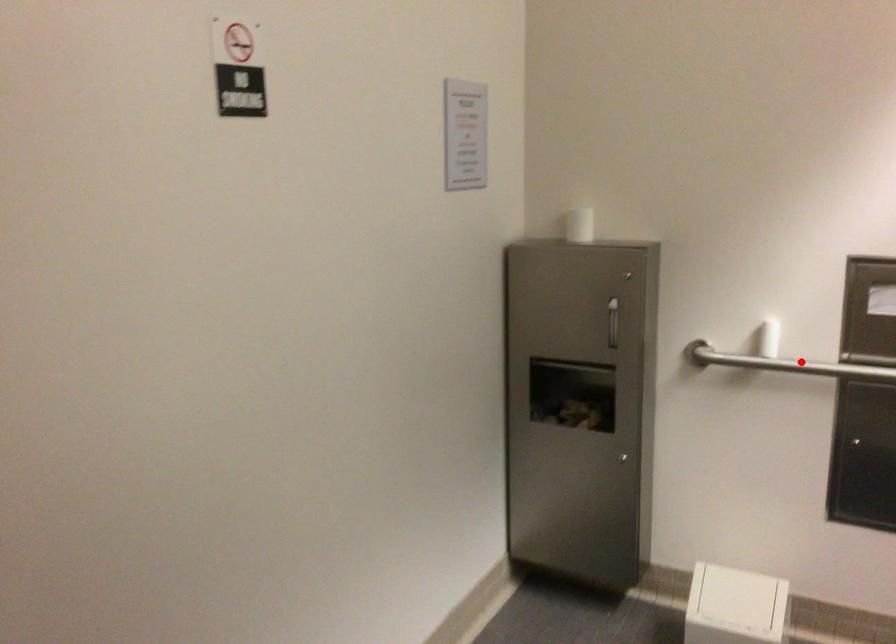
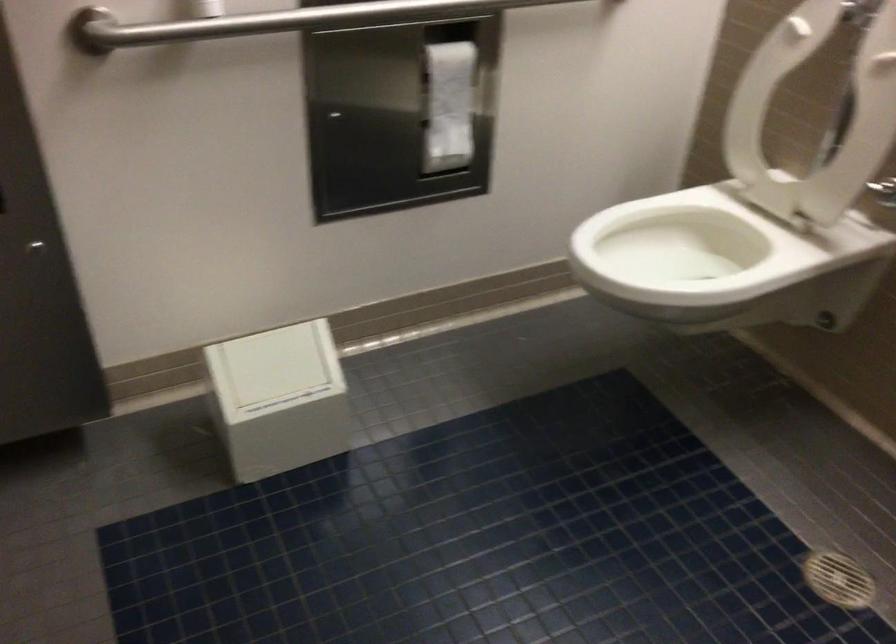
Question: I am providing you with two images of the same scene from different viewpoints. In image1, a red point is highlighted. Considering the same 3D point in image2, which of the following is correct?

Choices:
 (A) It is closer
 (B) It is farther

Answer: (A)